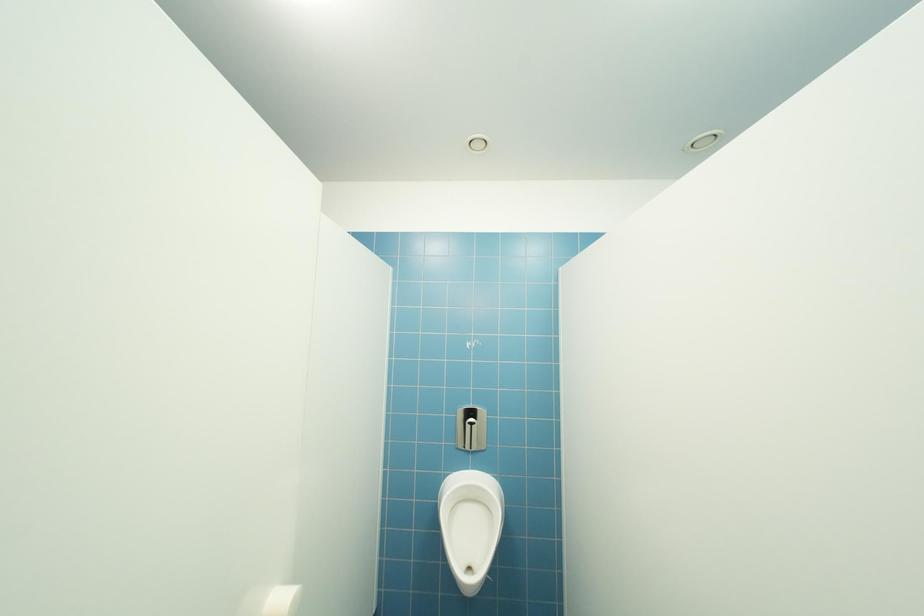
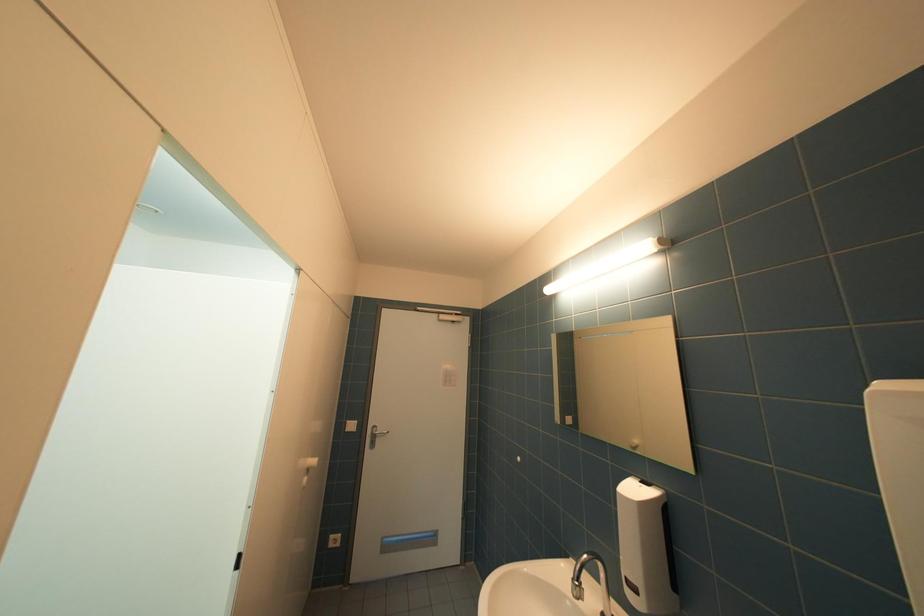
Question: The images are taken continuously from a first-person perspective. In which direction is your viewpoint rotating?

Choices:
 (A) Left
 (B) Right
 (C) Up
 (D) Down

Answer: (B)